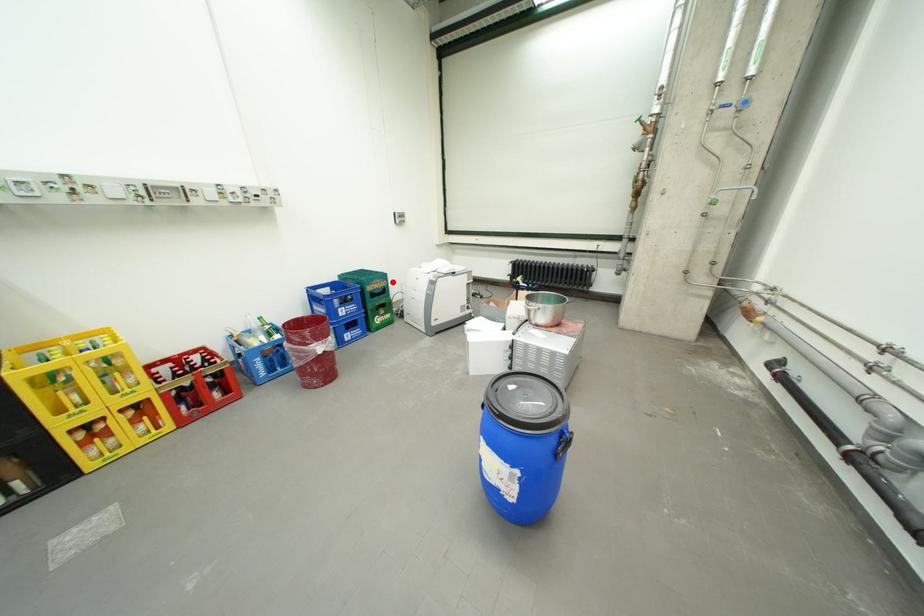
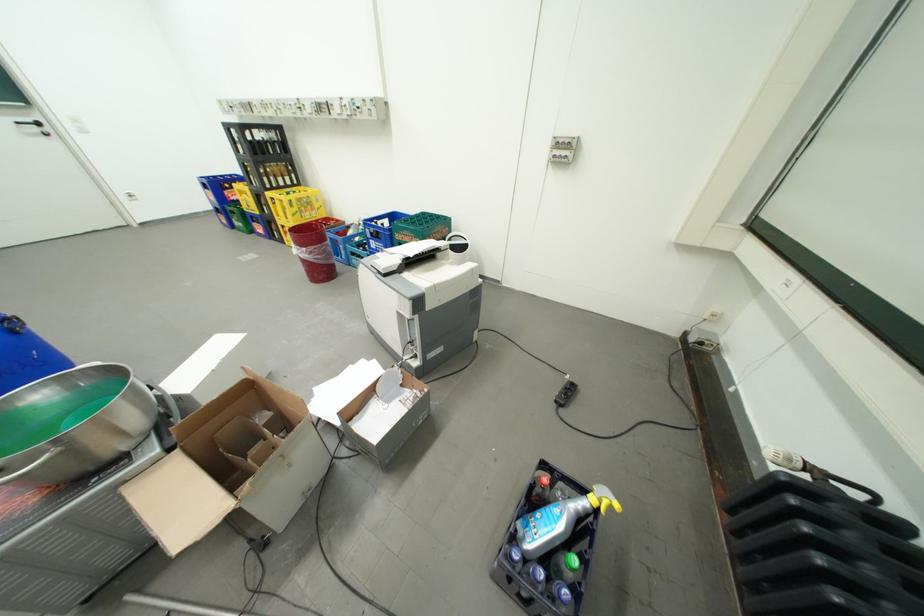
Question: I am providing you with two images of the same scene from different viewpoints. A red point is shown in image1. For the corresponding object point in image2, is it positioned nearer or farther from the camera?

Choices:
 (A) Nearer
 (B) Farther

Answer: (B)